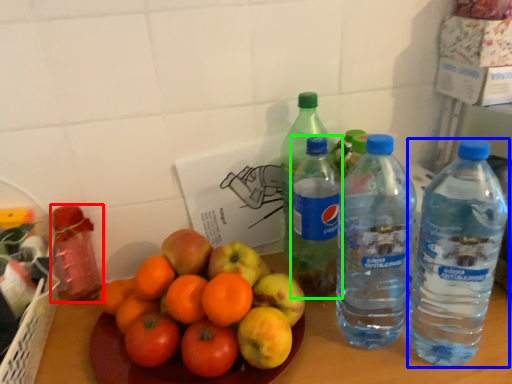
Question: Estimate the real-world distances between objects in this image. Which object is farther from bottle (highlighted by a red box), bottle (highlighted by a blue box) or bottle (highlighted by a green box)?

Choices:
 (A) bottle
 (B) bottle

Answer: (A)